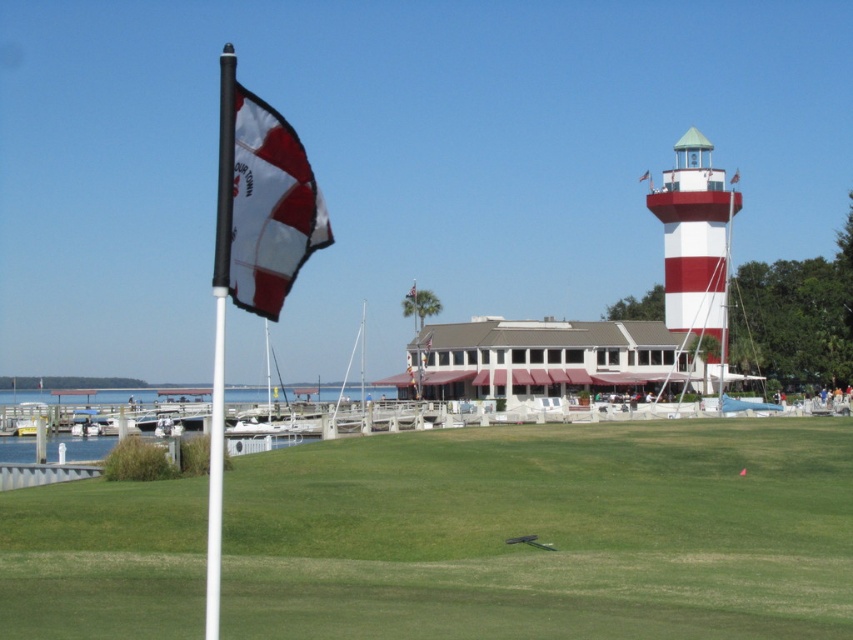
In the scene shown: Is white striped tower at right below white fabric flag at upper center?

Yes, white striped tower at right is below white fabric flag at upper center.

Who is lower down, white striped tower at right or white fabric flag at upper center?

white striped tower at right is lower down.

Is point (688, 262) positioned in front of point (643, 177)?

Yes, it is in front of point (643, 177).

Find the location of a particular element. The height and width of the screenshot is (640, 853). white striped tower at right is located at coordinates (695, 246).

Is green grass at center thinner than white fabric flag at upper center?

In fact, green grass at center might be wider than white fabric flag at upper center.

Which of these two, green grass at center or white fabric flag at upper center, stands taller?

With more height is white fabric flag at upper center.

Is point (198, 545) more distant than point (648, 176)?

That is False.

Identify the location of green grass at center. This screenshot has width=853, height=640. (546, 532).

Does green grass at center appear on the right side of white matte flag pole at left?

Yes, green grass at center is to the right of white matte flag pole at left.

Does point (381, 595) lie in front of point (213, 531)?

That is True.

Is point (625, 502) positioned behind point (225, 243)?

Yes, it is behind point (225, 243).

This screenshot has width=853, height=640. In order to click on green grass at center in this screenshot , I will do `click(546, 532)`.